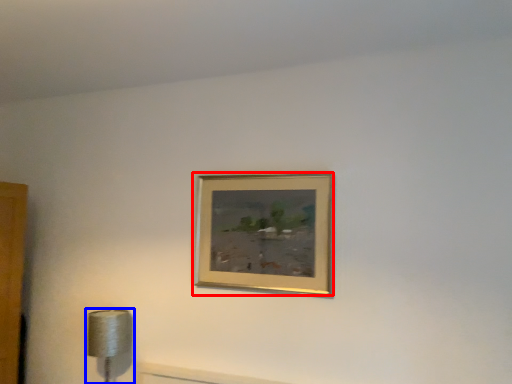
Question: Among these objects, which one is farthest to the camera, picture frame (highlighted by a red box) or lamp (highlighted by a blue box)?

Choices:
 (A) picture frame
 (B) lamp

Answer: (B)